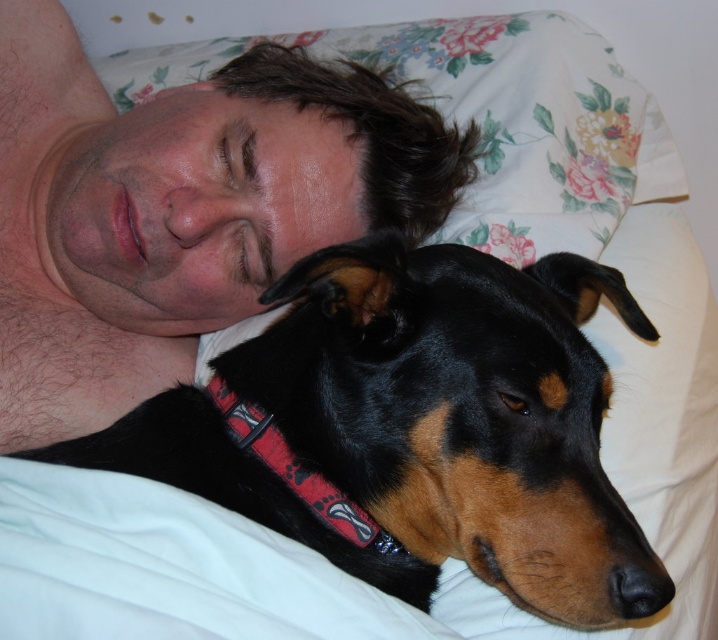
Does black shiny dog at center have a greater height compared to red fabric neckband at lower center?

Yes.

Does black shiny dog at center appear under red fabric neckband at lower center?

No, black shiny dog at center is not below red fabric neckband at lower center.

Describe the element at coordinates (419, 426) in the screenshot. I see `black shiny dog at center` at that location.

Find the location of a particular element. This screenshot has width=718, height=640. black shiny dog at center is located at coordinates (419, 426).

Who is lower down, hairless skin at upper center or red fabric neckband at lower center?

Positioned lower is red fabric neckband at lower center.

Is hairless skin at upper center taller than red fabric neckband at lower center?

Yes.

Between point (322, 112) and point (223, 397), which one is positioned in front?

Point (223, 397) is in front.

Identify the location of hairless skin at upper center. [x=177, y=209].

Can you confirm if black shiny dog at center is positioned to the left of hairless skin at upper center?

No, black shiny dog at center is not to the left of hairless skin at upper center.

Does black shiny dog at center have a lesser width compared to hairless skin at upper center?

No.

Identify the location of black shiny dog at center. The image size is (718, 640). (419, 426).